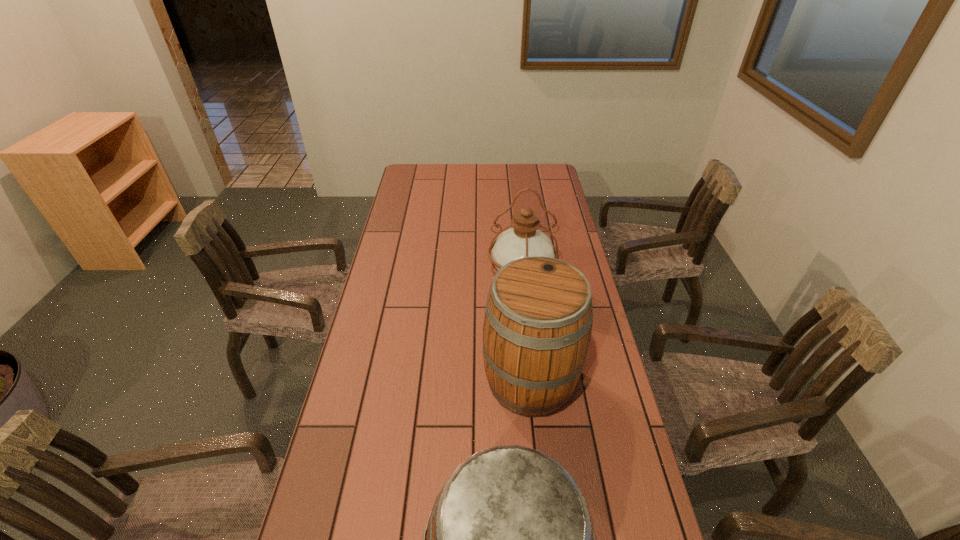
This screenshot has height=540, width=960. I want to click on free space at the far right corner of the desktop, so click(x=549, y=170).

The width and height of the screenshot is (960, 540). In order to click on object that can be found as the closest to the farthest object in this screenshot , I will do `click(538, 319)`.

In order to click on object that is the closest one to the nearest object in this screenshot , I will do `click(538, 319)`.